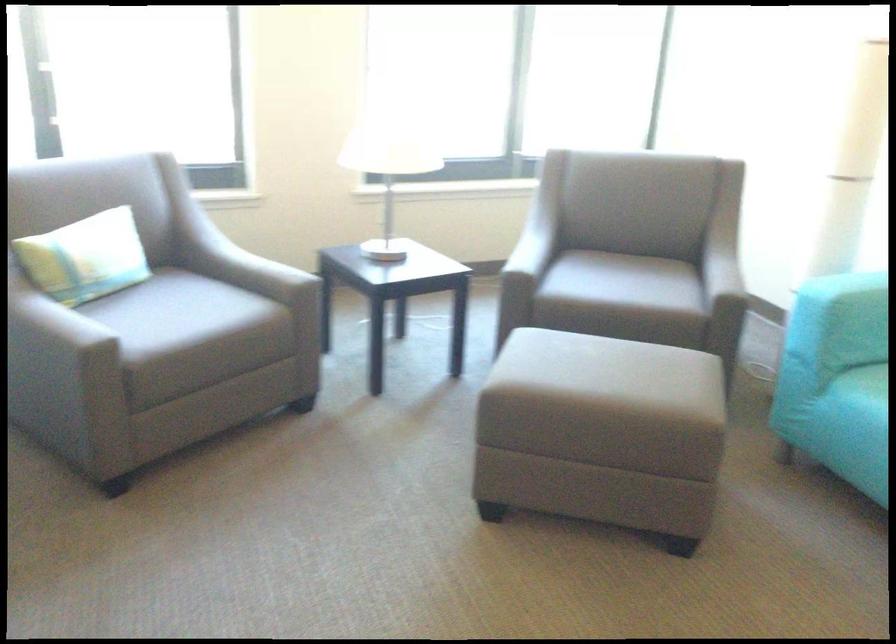
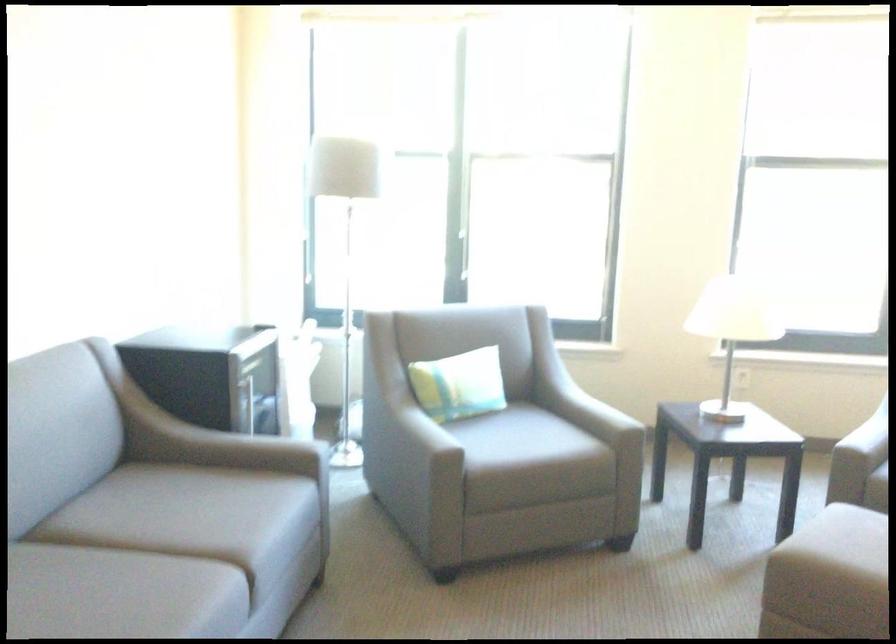
Where in the second image is the point corresponding to (147,306) from the first image?

(495, 431)